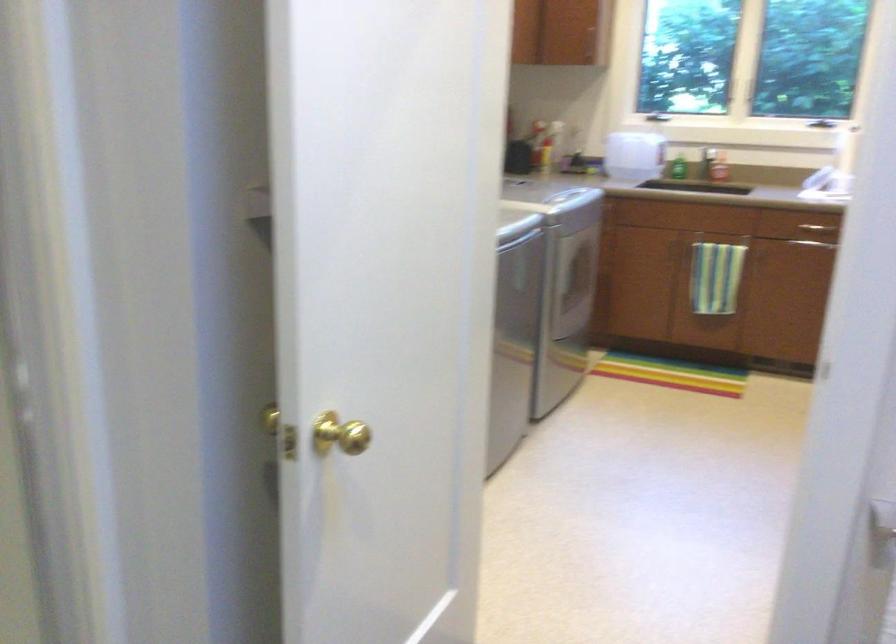
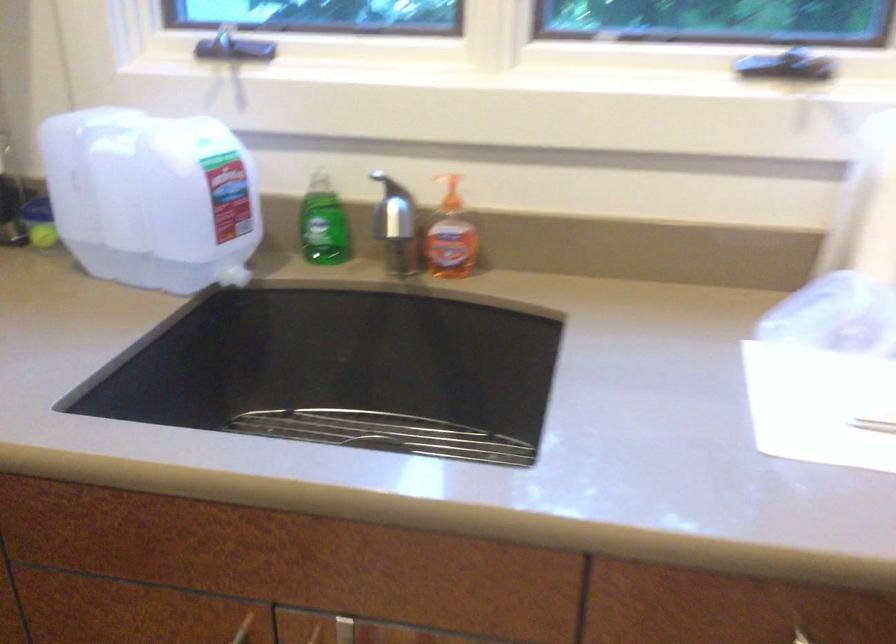
Locate, in the second image, the point that corresponds to the point at 678,160 in the first image.

(323, 223)